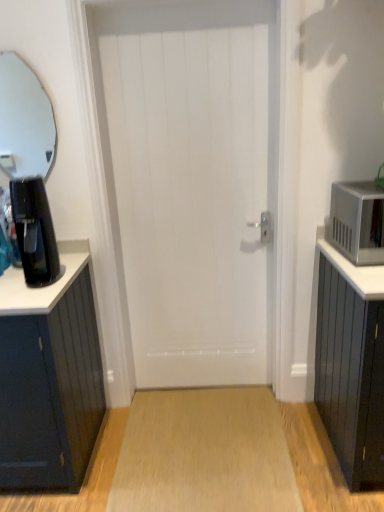
Question: Should I look upward or downward to see light brown wood floor at center?

Choices:
 (A) up
 (B) down

Answer: (B)

Question: Considering the relative sizes of white wooden door at center and satin silver microwave at right in the image provided, is white wooden door at center taller than satin silver microwave at right?

Choices:
 (A) no
 (B) yes

Answer: (B)

Question: Is satin silver microwave at right completely or partially inside white wooden door at center?

Choices:
 (A) yes
 (B) no

Answer: (B)

Question: Is white wooden door at center oriented away from satin silver microwave at right?

Choices:
 (A) no
 (B) yes

Answer: (A)

Question: From the image's perspective, is white wooden door at center above satin silver microwave at right?

Choices:
 (A) no
 (B) yes

Answer: (B)

Question: From the image's perspective, is white wooden door at center located beneath satin silver microwave at right?

Choices:
 (A) no
 (B) yes

Answer: (A)

Question: Is white wooden door at center to the left of satin silver microwave at right from the viewer's perspective?

Choices:
 (A) no
 (B) yes

Answer: (B)

Question: From a real-world perspective, is clear glass mirror at upper left positioned over white wooden door at center based on gravity?

Choices:
 (A) no
 (B) yes

Answer: (B)

Question: Is the depth of clear glass mirror at upper left less than that of white wooden door at center?

Choices:
 (A) no
 (B) yes

Answer: (A)

Question: Is clear glass mirror at upper left at the right side of white wooden door at center?

Choices:
 (A) yes
 (B) no

Answer: (B)

Question: Does clear glass mirror at upper left have a smaller size compared to white wooden door at center?

Choices:
 (A) no
 (B) yes

Answer: (B)

Question: Is clear glass mirror at upper left shorter than white wooden door at center?

Choices:
 (A) yes
 (B) no

Answer: (A)

Question: Is clear glass mirror at upper left at the left side of white wooden door at center?

Choices:
 (A) yes
 (B) no

Answer: (A)

Question: Is white wooden door at center outside light brown wood floor at center?

Choices:
 (A) yes
 (B) no

Answer: (A)